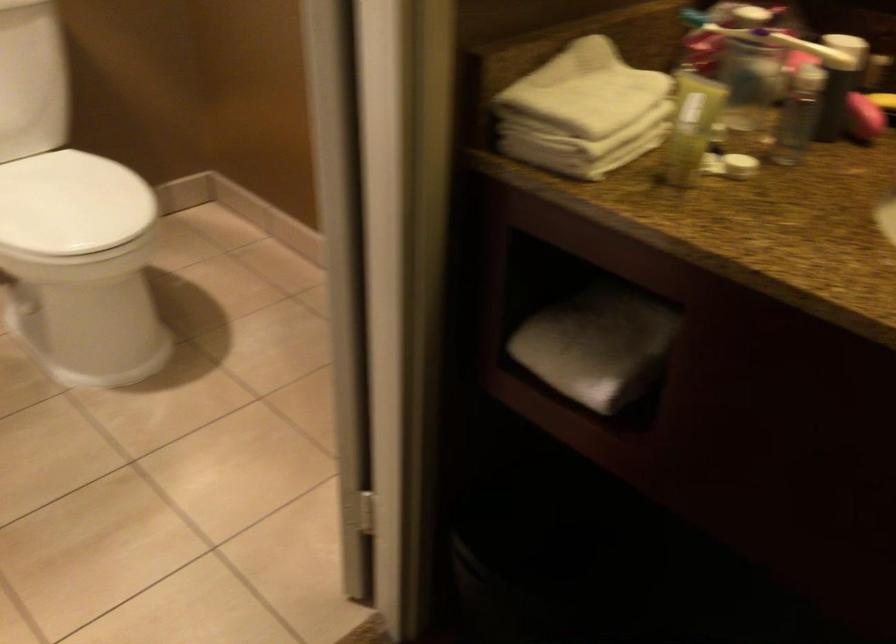
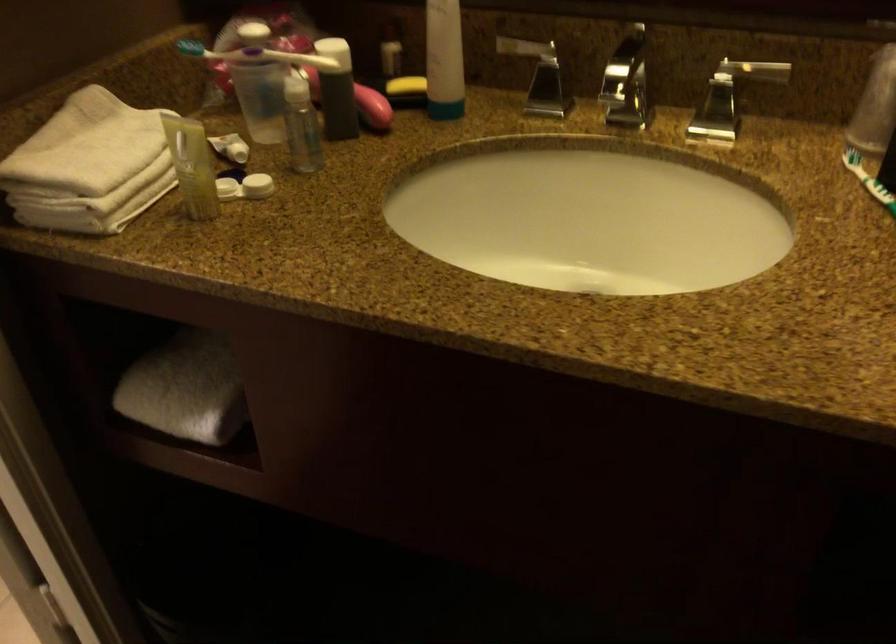
Where in the second image is the point corresponding to point 728,163 from the first image?

(245, 187)